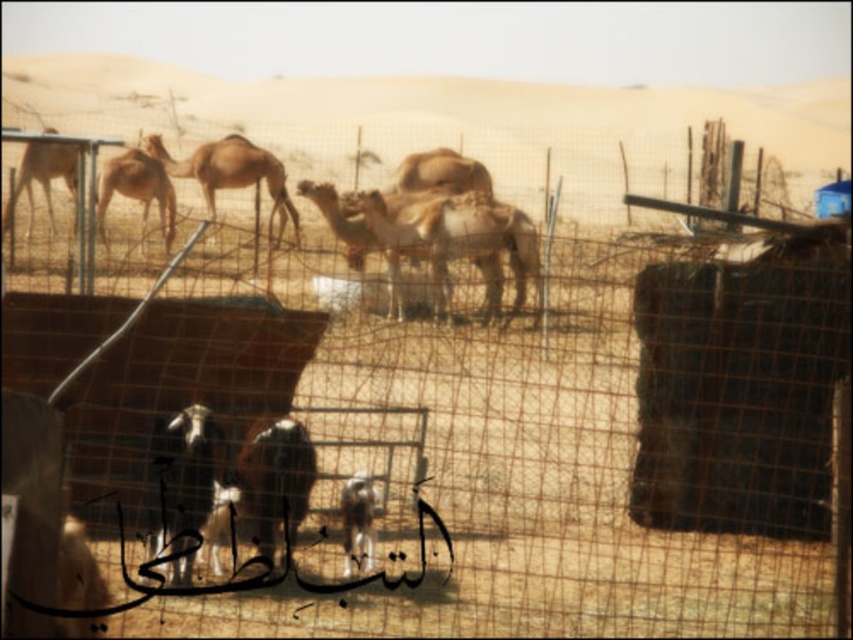
Question: Which object is positioned farthest from the light brown fur camel at left?

Choices:
 (A) brown textured camel at center
 (B) light brown fur camel at center
 (C) shiny black bird at lower left

Answer: (C)

Question: Can you confirm if light brown fur camel at center is wider than light brown textured camel at upper left?

Choices:
 (A) yes
 (B) no

Answer: (A)

Question: Is brown textured camel at center above brown fuzzy goat at center?

Choices:
 (A) yes
 (B) no

Answer: (A)

Question: Among these points, which one is farthest from the camera?

Choices:
 (A) (44, 160)
 (B) (363, 472)
 (C) (141, 173)
 (D) (242, 156)

Answer: (D)

Question: Among these points, which one is nearest to the camera?

Choices:
 (A) (21, 179)
 (B) (724, 118)
 (C) (173, 232)
 (D) (473, 244)

Answer: (D)

Question: Is brown sandy dirt field at center thinner than light brown textured camel at upper left?

Choices:
 (A) yes
 (B) no

Answer: (B)